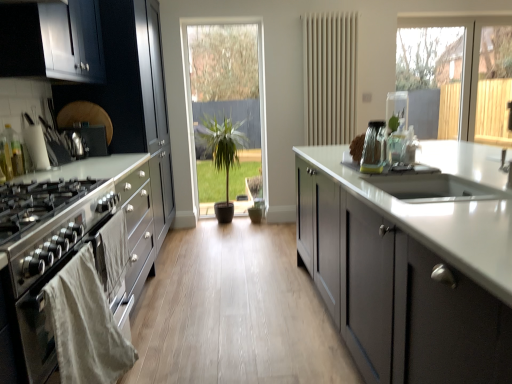
The height and width of the screenshot is (384, 512). What do you see at coordinates (223, 156) in the screenshot?
I see `green matte plant at center` at bounding box center [223, 156].

Image resolution: width=512 pixels, height=384 pixels. Describe the element at coordinates (85, 325) in the screenshot. I see `white cloth oven at left` at that location.

Identify the location of green matte plant at center. This screenshot has width=512, height=384. (223, 156).

Would you say beige matte radiator at center is inside or outside satin silver knife block at left, which appears as the 1th appliance when viewed from the left?

beige matte radiator at center is outside satin silver knife block at left, which appears as the 1th appliance when viewed from the left.

Considering the relative sizes of beige matte radiator at center and satin silver knife block at left, which appears as the 1th appliance when viewed from the left, in the image provided, is beige matte radiator at center taller than satin silver knife block at left, which appears as the 1th appliance when viewed from the left,?

Indeed, beige matte radiator at center has a greater height compared to satin silver knife block at left, which appears as the 1th appliance when viewed from the left.

Which object is further away from the camera, beige matte radiator at center or satin silver knife block at left, which appears as the 1th appliance when viewed from the left?

beige matte radiator at center is more distant.

Can you confirm if beige matte radiator at center is smaller than satin silver knife block at left, the 2th appliance in the front-to-back sequence?

No.

In the scene shown: Is beige matte radiator at center positioned with its back to green leafy plant at center?

No, green leafy plant at center is not at the back of beige matte radiator at center.

From the image's perspective, is beige matte radiator at center below green leafy plant at center?

No.

Which of these two, beige matte radiator at center or green leafy plant at center, is wider?

beige matte radiator at center.

Are white cloth oven at left and clear glass jars at right, the first appliance when ordered from right to left, located far from each other?

Yes, white cloth oven at left and clear glass jars at right, the first appliance when ordered from right to left, are quite far apart.

Can you confirm if white cloth oven at left is smaller than clear glass jars at right, positioned as the 2th appliance in back-to-front order?

Actually, white cloth oven at left might be larger than clear glass jars at right, positioned as the 2th appliance in back-to-front order.

Considering the relative positions of white cloth oven at left and clear glass jars at right, the second appliance from the left, in the image provided, is white cloth oven at left to the left of clear glass jars at right, the second appliance from the left, from the viewer's perspective?

Correct, you'll find white cloth oven at left to the left of clear glass jars at right, the second appliance from the left.

Find the location of `cabinetry on the left of clear glass jars at right, which ranks as the first appliance in front-to-back order`. cabinetry on the left of clear glass jars at right, which ranks as the first appliance in front-to-back order is located at coordinates (99, 177).

How different are the orientations of satin black cabinets at left, which ranks as the 2th cabinetry in right-to-left order, and clear glass jars at right, which ranks as the first appliance in front-to-back order, in degrees?

The facing directions of satin black cabinets at left, which ranks as the 2th cabinetry in right-to-left order, and clear glass jars at right, which ranks as the first appliance in front-to-back order, are 179 degrees apart.

Considering their positions, is satin black cabinets at left, the first cabinetry positioned from the left, located in front of or behind clear glass jars at right, the second appliance from the left?

Clearly, satin black cabinets at left, the first cabinetry positioned from the left, is behind clear glass jars at right, the second appliance from the left.

Consider the image. From the image's perspective, relative to clear glass jars at right, positioned as the 2th appliance in back-to-front order, is satin black cabinets at left, which ranks as the 2th cabinetry in right-to-left order, above or below?

satin black cabinets at left, which ranks as the 2th cabinetry in right-to-left order, is situated higher than clear glass jars at right, positioned as the 2th appliance in back-to-front order, in the image.

Is satin black cabinets at left, which ranks as the 2th cabinetry in right-to-left order, not near stainless steel oven at left?

No, satin black cabinets at left, which ranks as the 2th cabinetry in right-to-left order, is not far away from stainless steel oven at left.

Identify the location of cabinetry behind the stainless steel oven at left. (99, 177).

Considering the sizes of objects satin black cabinets at left, the first cabinetry positioned from the left, and stainless steel oven at left in the image provided, who is thinner, satin black cabinets at left, the first cabinetry positioned from the left, or stainless steel oven at left?

stainless steel oven at left is thinner.

Can you tell me how much satin black cabinets at left, which ranks as the 2th cabinetry in right-to-left order, and stainless steel oven at left differ in facing direction?

0.354 degrees.

From a real-world perspective, who is located higher, white cloth oven at left or stainless steel oven at left?

white cloth oven at left, from a real-world perspective.

Based on their positions, is white cloth oven at left located to the left or right of stainless steel oven at left?

white cloth oven at left is positioned on stainless steel oven at left's right side.

Are white cloth oven at left and stainless steel oven at left far apart?

No, there isn't a large distance between white cloth oven at left and stainless steel oven at left.

Find the location of a particular element. oven below the white cloth oven at left (from the image's perspective) is located at coordinates (45, 253).

Measure the distance from stainless steel oven at left to satin black cabinets at left, which ranks as the 2th cabinetry in right-to-left order.

They are 11.32 inches apart.

In terms of height, does stainless steel oven at left look taller or shorter compared to satin black cabinets at left, which ranks as the 2th cabinetry in right-to-left order?

Considering their sizes, stainless steel oven at left has less height than satin black cabinets at left, which ranks as the 2th cabinetry in right-to-left order.

What's the angular difference between stainless steel oven at left and satin black cabinets at left, which ranks as the 2th cabinetry in right-to-left order,'s facing directions?

stainless steel oven at left and satin black cabinets at left, which ranks as the 2th cabinetry in right-to-left order, are facing 0.354 degrees away from each other.

Is stainless steel oven at left in front of or behind satin black cabinets at left, the first cabinetry positioned from the left, in the image?

stainless steel oven at left is positioned closer to the viewer than satin black cabinets at left, the first cabinetry positioned from the left.

Where is `the 1st appliance below when counting from the beige matte radiator at center (from the image's perspective)`? This screenshot has width=512, height=384. the 1st appliance below when counting from the beige matte radiator at center (from the image's perspective) is located at coordinates (92, 138).

Find the location of `window screen behind the beige matte radiator at center`. window screen behind the beige matte radiator at center is located at coordinates (227, 75).

When comparing their distances from white cloth oven at left, does green leafy plant at center or satin silver knife block at left, which appears as the 1th appliance when viewed from the left, seem further?

green leafy plant at center.

From the image, which object appears to be nearer to beige matte radiator at center, matte gray cabinets at center, the 1th cabinetry when ordered from right to left, or clear glass jars at right, the first appliance when ordered from right to left?

The object closer to beige matte radiator at center is clear glass jars at right, the first appliance when ordered from right to left.

Estimate the real-world distances between objects in this image. Which object is further from stainless steel oven at left, beige matte radiator at center or matte gray cabinets at center, which is counted as the 2th cabinetry, starting from the left?

The object further to stainless steel oven at left is beige matte radiator at center.

When comparing their distances from beige matte radiator at center, does green leafy plant at center or clear glass jars at right, the first appliance when ordered from right to left, seem closer?

green leafy plant at center.

Based on their spatial positions, is beige matte radiator at center or clear glass jars at right, positioned as the 2th appliance in back-to-front order, further from green matte plant at center?

Based on the image, clear glass jars at right, positioned as the 2th appliance in back-to-front order, appears to be further to green matte plant at center.

From the image, which object appears to be nearer to satin black cabinets at left, the first cabinetry positioned from the left, white cloth oven at left or satin silver knife block at left, the 2th appliance when ordered from right to left?

white cloth oven at left is closer to satin black cabinets at left, the first cabinetry positioned from the left.

Looking at the image, which one is located closer to white cloth oven at left, clear glass jars at right, the first appliance when ordered from right to left, or satin silver knife block at left, the 2th appliance in the front-to-back sequence?

The object closer to white cloth oven at left is clear glass jars at right, the first appliance when ordered from right to left.

Based on their spatial positions, is satin silver knife block at left, the 2th appliance when ordered from right to left, or green matte plant at center further from stainless steel oven at left?

green matte plant at center is further to stainless steel oven at left.

You are a GUI agent. You are given a task and a screenshot of the screen. Output one action in this format:
    pyautogui.click(x=<x>, y=<y>)
    Task: Click on the material between stainless steel oven at left and green leafy plant at center in the front-back direction
    This screenshot has height=384, width=512.
    Given the screenshot: What is the action you would take?
    pyautogui.click(x=85, y=325)

Find the location of a particular element. The height and width of the screenshot is (384, 512). radiator between matte gray cabinets at center, which is counted as the 2th cabinetry, starting from the left, and green matte plant at center from front to back is located at coordinates (329, 77).

What are the coordinates of `material between matte gray cabinets at center, the 1th cabinetry when ordered from right to left, and green leafy plant at center from front to back` in the screenshot? It's located at (85, 325).

Image resolution: width=512 pixels, height=384 pixels. Identify the location of cabinetry between white cloth oven at left and beige matte radiator at center along the z-axis. pyautogui.click(x=99, y=177).